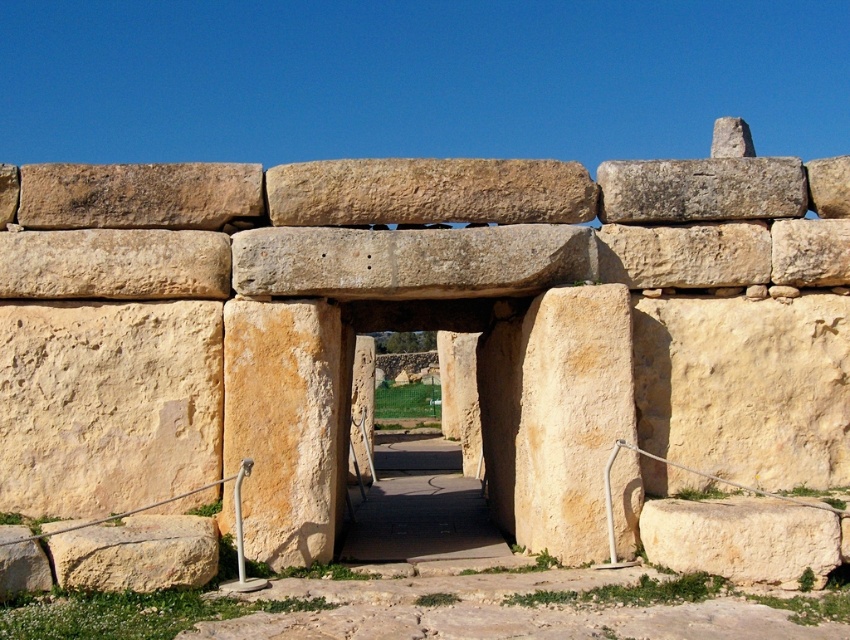
You are an archaeologist examining the ancient stone structure. You notice the smooth beige stone at upper right and the yellowish stone at upper center. Which stone has a greater height?

The smooth beige stone at upper right is taller than the yellowish stone at upper center.

You are an archaeologist examining the ancient stone structure. You notice two stones of interest. One is the smooth beige stone at center and the other is the yellowish stone at upper center. Which stone would you need to look up to see more clearly?

You would need to look up to see the yellowish stone at upper center more clearly because it is further away from the viewer compared to the smooth beige stone at center.